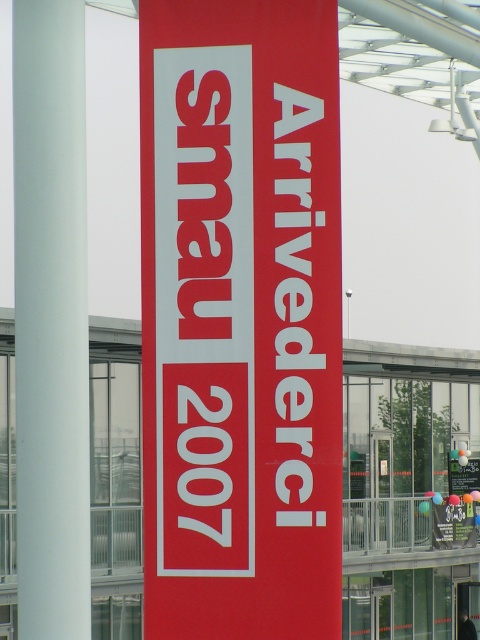
Question: Which point is closer to the camera?

Choices:
 (A) (36, 346)
 (B) (176, 339)

Answer: (A)

Question: Which point is closer to the camera taking this photo?

Choices:
 (A) [295, 365]
 (B) [78, 51]

Answer: (B)

Question: Which point is farther from the camera taking this photo?

Choices:
 (A) (51, 410)
 (B) (190, 534)

Answer: (B)

Question: Is matte red banner at center to the right of white smooth pole at left from the viewer's perspective?

Choices:
 (A) yes
 (B) no

Answer: (A)

Question: Does matte red banner at center lie behind white smooth pole at left?

Choices:
 (A) yes
 (B) no

Answer: (A)

Question: Is matte red banner at center below white smooth pole at left?

Choices:
 (A) yes
 (B) no

Answer: (B)